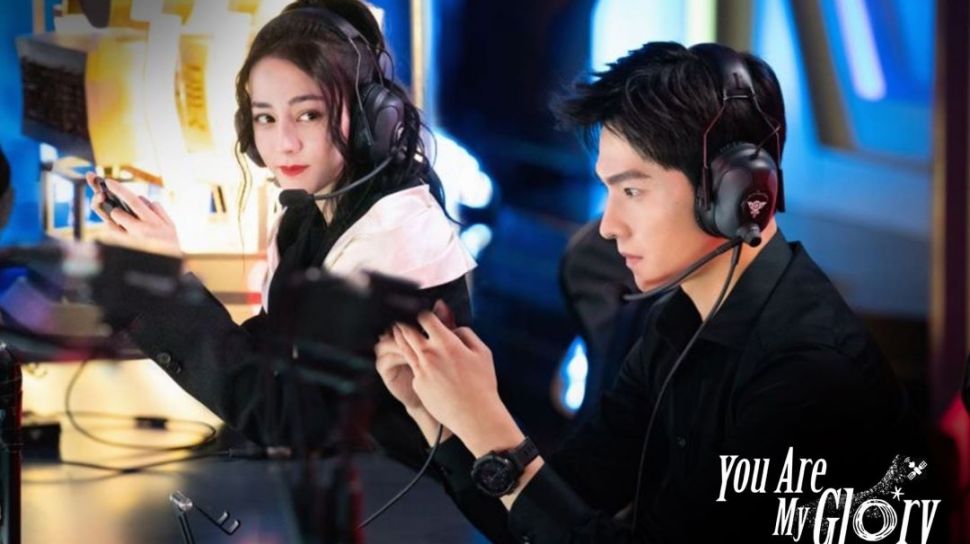
Where is `head phones`? head phones is located at coordinates (754, 195), (386, 123).